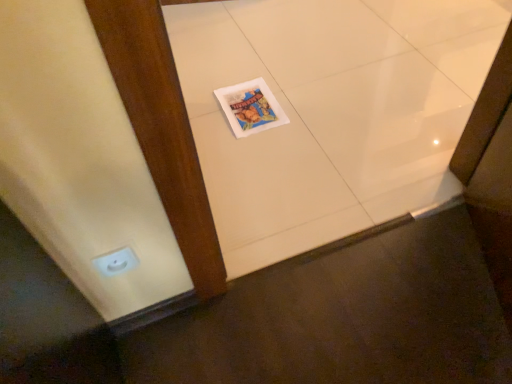
This screenshot has width=512, height=384. I want to click on free space to the left of matte paper magazine at center, so click(205, 107).